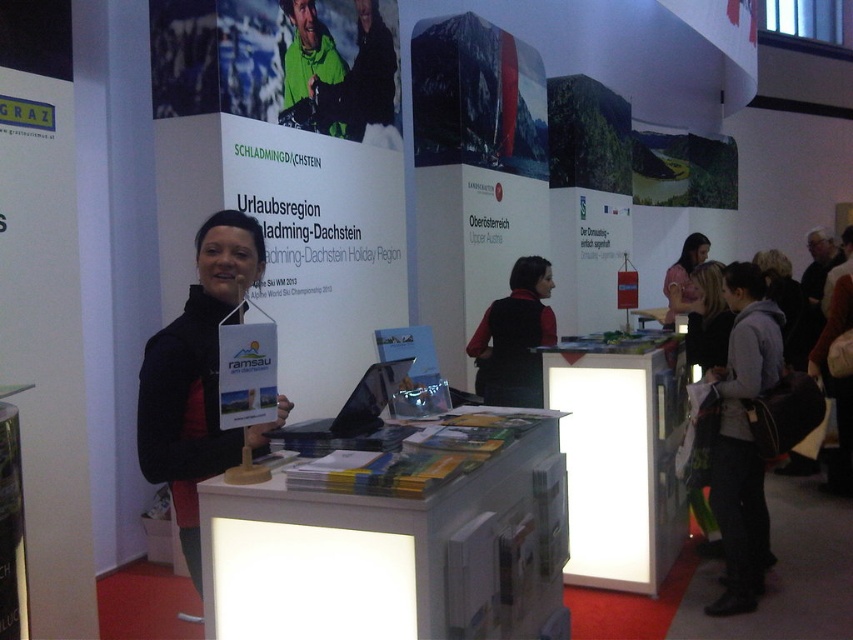
You are standing at the Schladming Dachstein exhibition booth and want to pick up the brochure from the white plastic table at center. Is the table within your reach?

The white plastic table at center is 4.65 feet away from the viewer, so it is within reach.

You are standing at the entrance of the trade show booth and want to pick up a brochure from the white plastic table at center. In which direction should you move to reach the table?

The white plastic table at center is located at coordinates approximately 0.866 on the x axis and 0.461 on the y axis. Since you are at the entrance, you should move towards the center of the booth to reach the white plastic table at center.

Looking at this image, you are standing at the Schladming booth and want to pick up the brochure titled Ramsau. The brochure is located at point marked as point (728, 488). If you can reach up to 10 feet, can you reach it?

The point (728, 488) is 10.85 feet away from the viewer. Since your reach is only up to 10 feet, you cannot reach the brochure at point (728, 488).